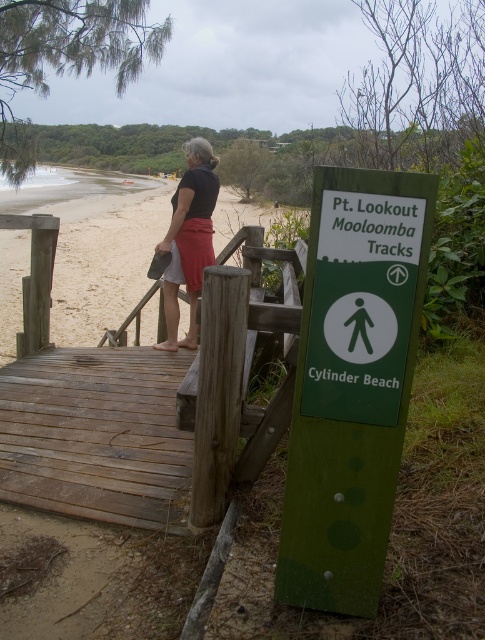
Question: Which of the following is the farthest from the observer?

Choices:
 (A) matte black shirt at center
 (B) sandy beach at left

Answer: (B)

Question: Is green matte sign at center further to camera compared to matte black shirt at center?

Choices:
 (A) yes
 (B) no

Answer: (B)

Question: Which point is farther to the camera?

Choices:
 (A) (183, 148)
 (B) (349, 524)

Answer: (A)

Question: Observing the image, what is the correct spatial positioning of green matte sign at center in reference to matte black shirt at center?

Choices:
 (A) left
 (B) right

Answer: (B)

Question: Does green matte sign at center appear on the right side of sandy beach at left?

Choices:
 (A) yes
 (B) no

Answer: (A)

Question: Which point is farther to the camera?

Choices:
 (A) (385, 280)
 (B) (166, 220)
 (C) (180, 202)

Answer: (B)